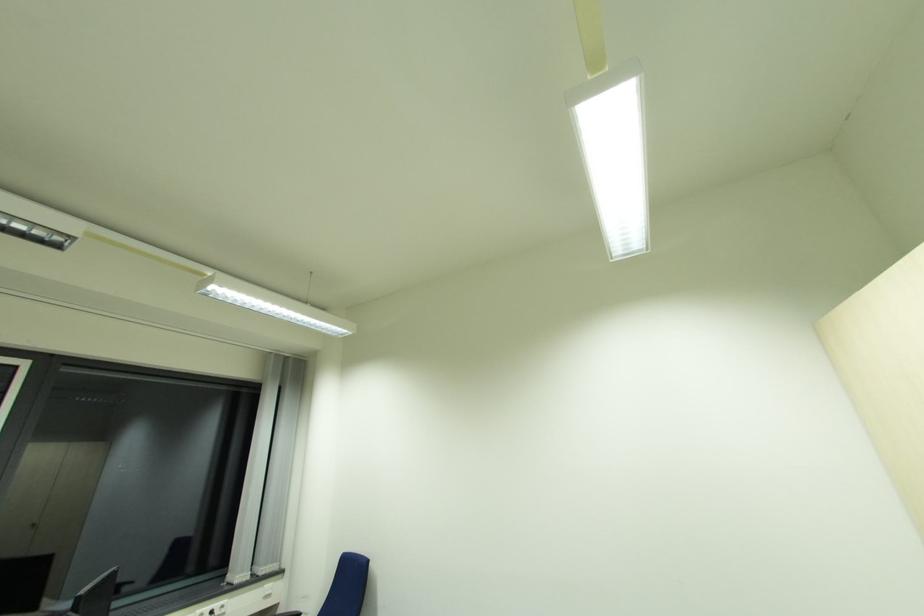
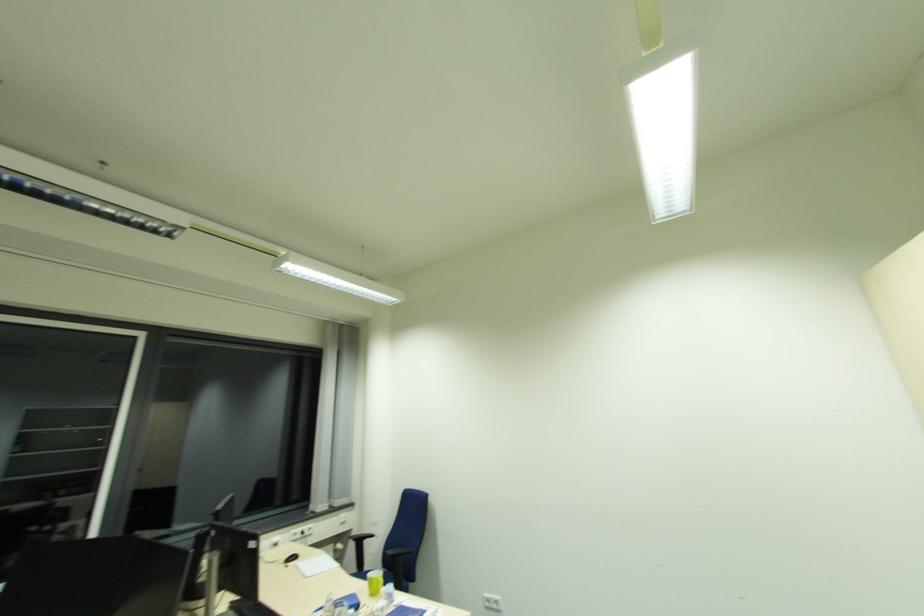
Question: How did the camera likely rotate?

Choices:
 (A) Left
 (B) Right
 (C) Up
 (D) Down

Answer: (D)